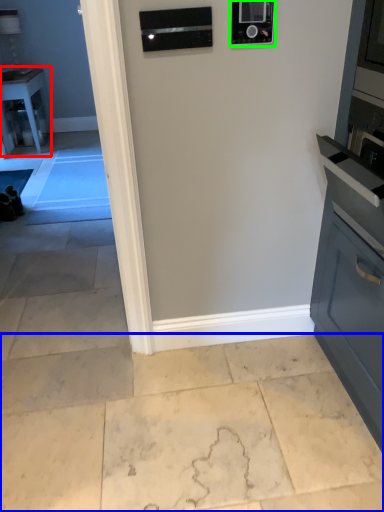
Question: Estimate the real-world distances between objects in this image. Which object is closer to table (highlighted by a red box), concrete (highlighted by a blue box) or appliance (highlighted by a green box)?

Choices:
 (A) concrete
 (B) appliance

Answer: (A)